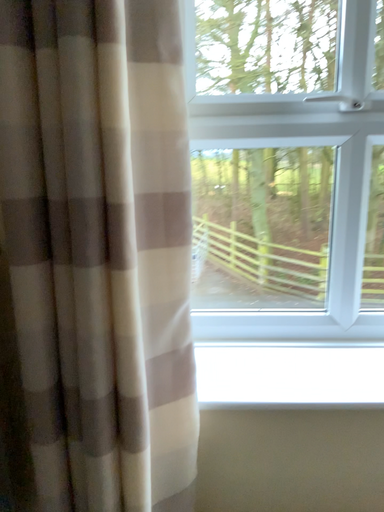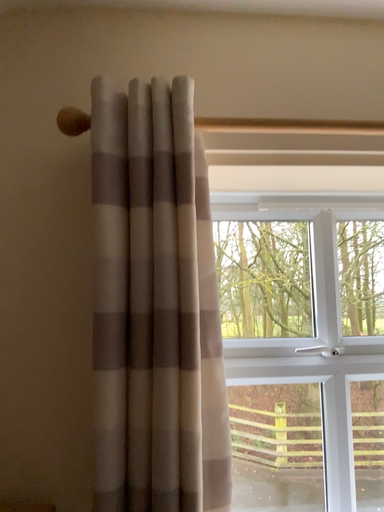
Question: Which way did the camera rotate in the video?

Choices:
 (A) rotated downward
 (B) rotated upward

Answer: (B)